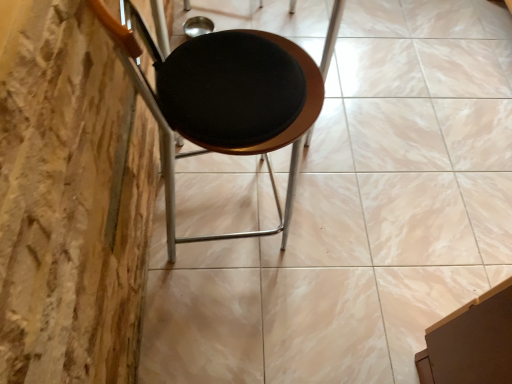
At what (x,y) coordinates should I click in order to perform the action: click on vacant space in front of matte black stool at center. Please return your answer as a coordinate pair (x, y). This screenshot has width=512, height=384. Looking at the image, I should click on (243, 314).